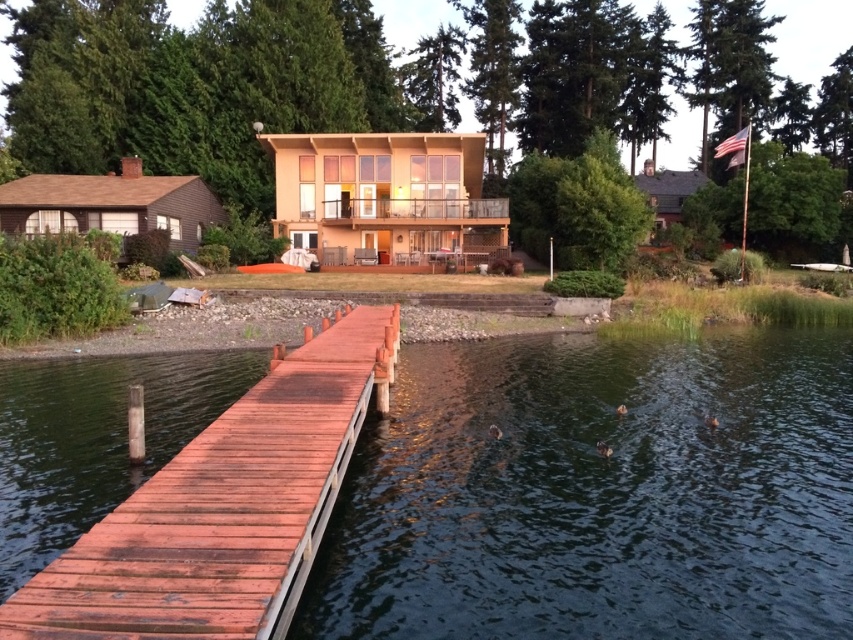
Is dark blue water at lower center positioned in front of smooth reddish-brown wooden dock at center?

No.

Is dark blue water at lower center taller than smooth reddish-brown wooden dock at center?

Incorrect, dark blue water at lower center's height is not larger of smooth reddish-brown wooden dock at center's.

Who is more distant from viewer, (515, 461) or (207, 627)?

Point (515, 461)

The width and height of the screenshot is (853, 640). Find the location of `dark blue water at lower center`. dark blue water at lower center is located at coordinates (599, 492).